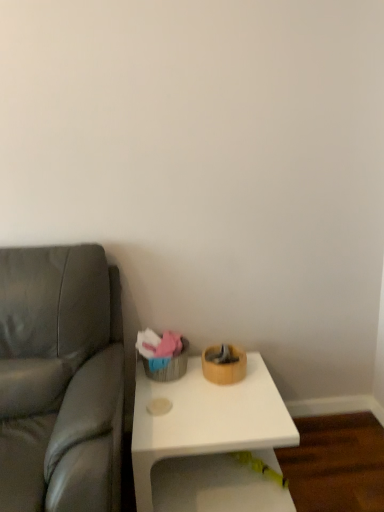
I want to click on free space above white matte table at center (from a real-world perspective), so click(x=203, y=397).